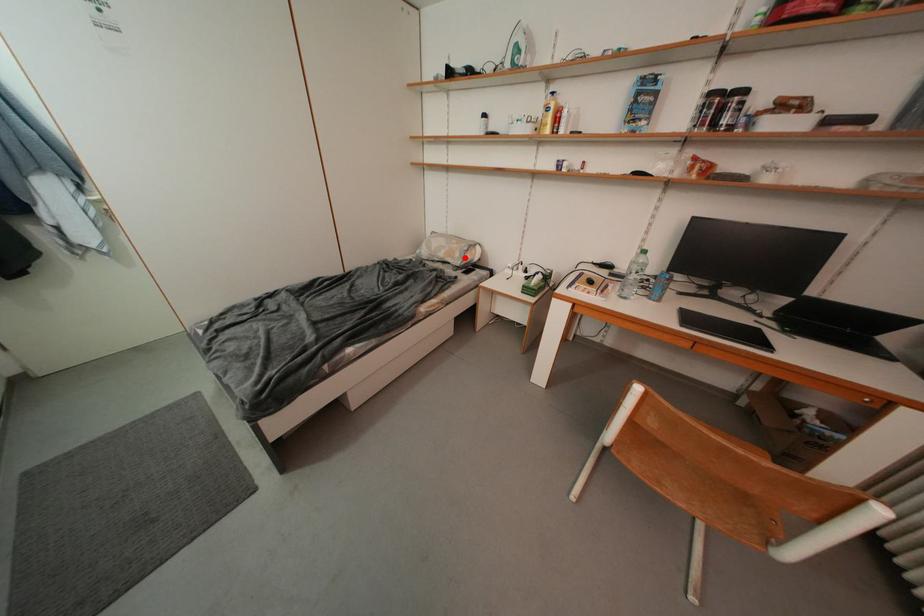
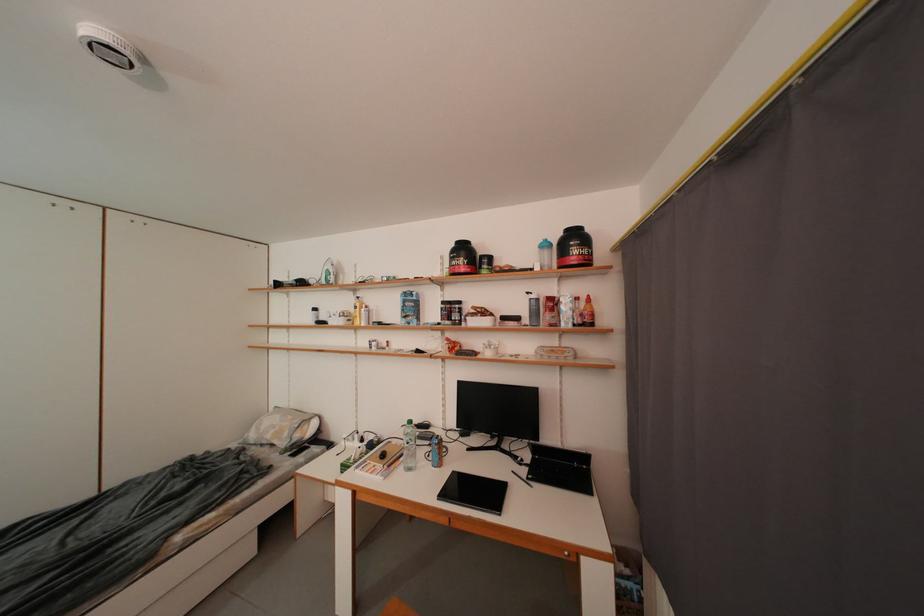
Question: I am providing you with two images of the same scene from different viewpoints. A red point is shown in image1. For the corresponding object point in image2, is it positioned nearer or farther from the camera?

Choices:
 (A) Nearer
 (B) Farther

Answer: (B)